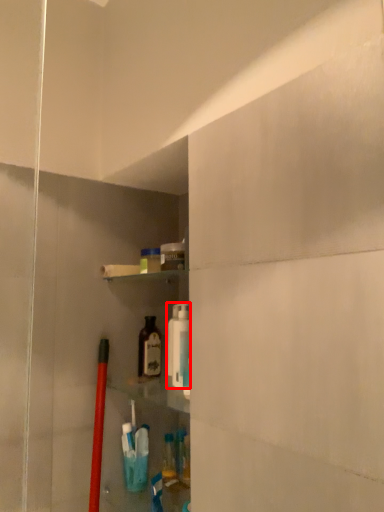
Question: Where is cleaning product (annotated by the red box) located in relation to bottle in the image?

Choices:
 (A) right
 (B) left

Answer: (A)